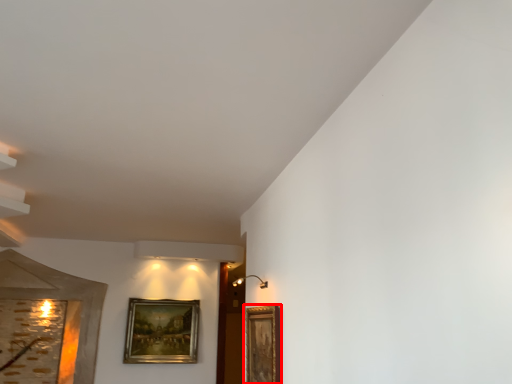
Question: Considering the relative positions of picture frame (annotated by the red box) and picture frame in the image provided, where is picture frame (annotated by the red box) located with respect to the staircase?

Choices:
 (A) right
 (B) left

Answer: (A)